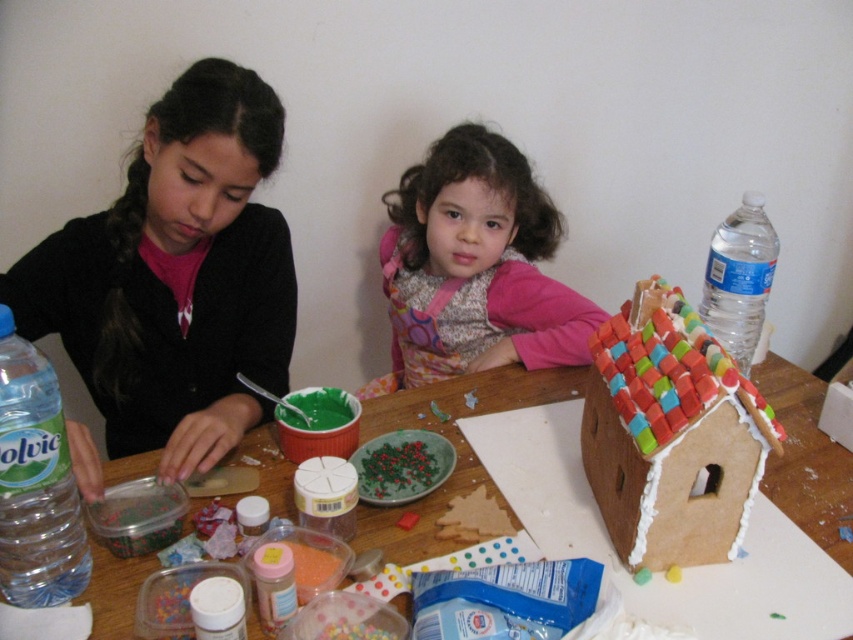
Question: Which object is positioned farthest from the fluffy pink sweater at upper center?

Choices:
 (A) wooden table at center
 (B) clear plastic bottle at lower left
 (C) colorful candy house at center
 (D) matte black sweater at left

Answer: (B)

Question: Which of these objects is positioned farthest from the wooden table at center?

Choices:
 (A) colorful candy house at center
 (B) clear plastic bottle at upper right
 (C) clear plastic bottle at lower left
 (D) matte black sweater at left

Answer: (B)

Question: From the image, what is the correct spatial relationship of fluffy pink sweater at upper center in relation to clear plastic bottle at lower left?

Choices:
 (A) left
 (B) right

Answer: (B)

Question: Can you confirm if colorful candy house at center is wider than clear plastic bottle at upper right?

Choices:
 (A) yes
 (B) no

Answer: (B)

Question: Can you confirm if fluffy pink sweater at upper center is wider than clear plastic bottle at upper right?

Choices:
 (A) no
 (B) yes

Answer: (B)

Question: Which object is closer to the camera taking this photo?

Choices:
 (A) clear plastic bottle at upper right
 (B) wooden table at center

Answer: (B)